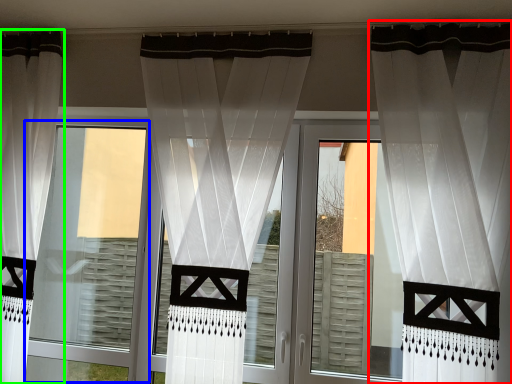
Question: Estimate the real-world distances between objects in this image. Which object is farther from curtain (highlighted by a red box), window frame (highlighted by a blue box) or curtain (highlighted by a green box)?

Choices:
 (A) window frame
 (B) curtain

Answer: (B)